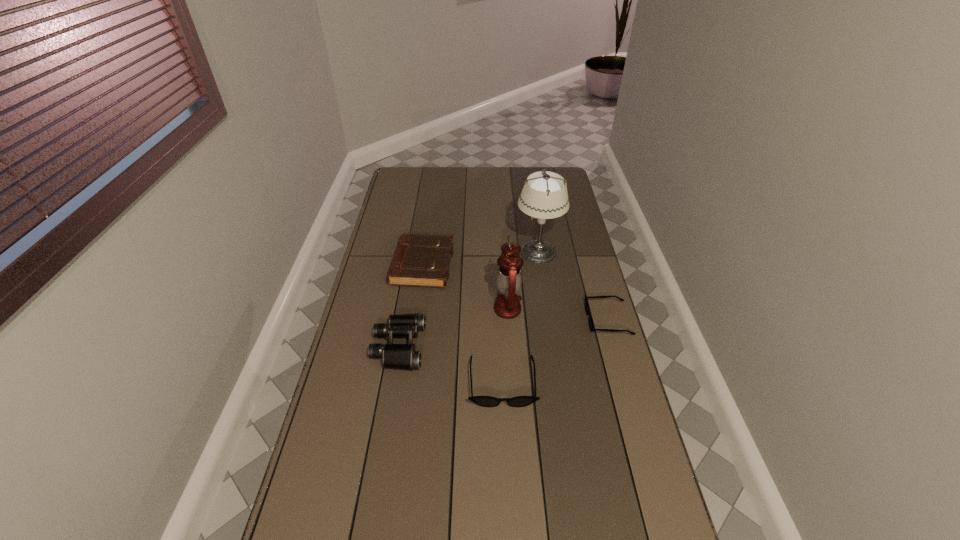
Find the location of a particular element. This screenshot has width=960, height=540. free space located 0.170m on the front-facing side of the rightmost object is located at coordinates (540, 320).

The width and height of the screenshot is (960, 540). What are the coordinates of `vacant space positioned on the front-facing side of the rightmost object` in the screenshot? It's located at (478, 320).

The width and height of the screenshot is (960, 540). In order to click on vacant space situated 0.080m on the back of the fourth tallest object in this screenshot , I will do `click(427, 233)`.

Where is `free space located 0.080m on the lampshade of the lampshade`? free space located 0.080m on the lampshade of the lampshade is located at coordinates (495, 251).

The width and height of the screenshot is (960, 540). Find the location of `free location located on the lampshade of the lampshade`. free location located on the lampshade of the lampshade is located at coordinates coord(481,251).

Image resolution: width=960 pixels, height=540 pixels. Identify the location of free space located on the lampshade of the lampshade. (484, 251).

Where is `vacant region located 0.230m on the front of the oil lamp`? The height and width of the screenshot is (540, 960). vacant region located 0.230m on the front of the oil lamp is located at coordinates (512, 379).

You are a GUI agent. You are given a task and a screenshot of the screen. Output one action in this format:
    pyautogui.click(x=<x>, y=<y>)
    Task: Click on the vacant space located on the front-facing side of the binoculars
    This screenshot has height=540, width=960.
    Given the screenshot: What is the action you would take?
    pyautogui.click(x=540, y=346)

Where is `hardback book present at the left edge`? hardback book present at the left edge is located at coordinates (419, 260).

In order to click on binoculars that is positioned at the left edge in this screenshot , I will do `click(394, 356)`.